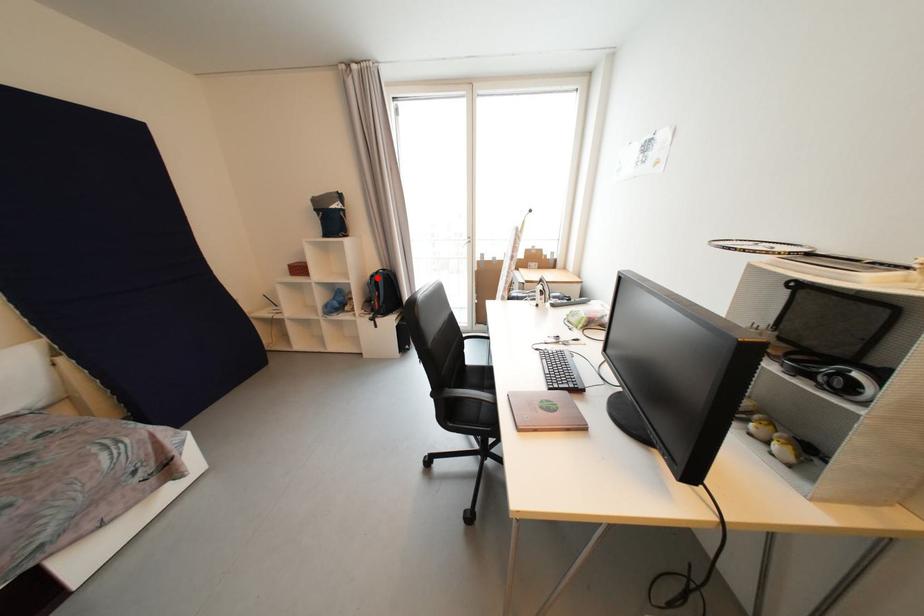
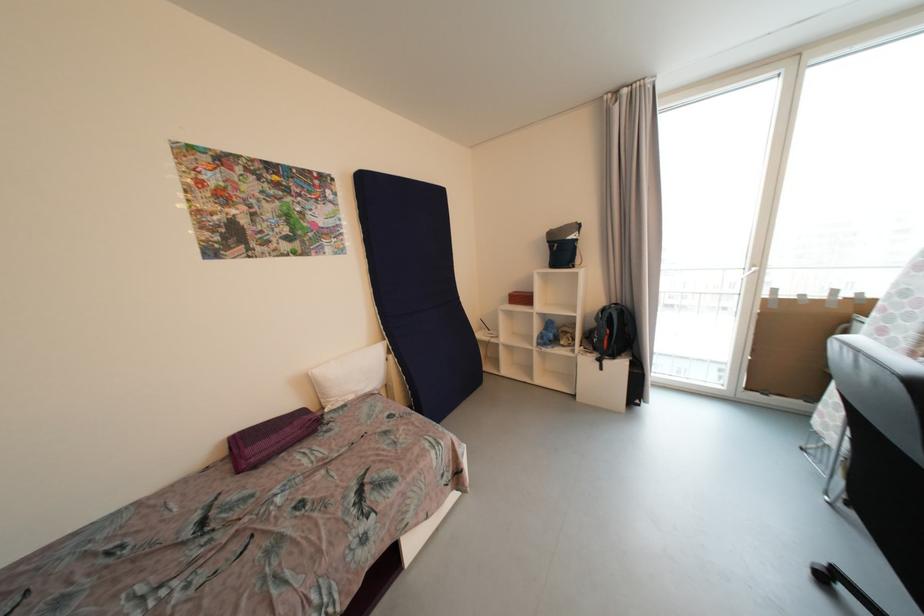
Question: I am providing you with two images of the same scene from different viewpoints. A red point is shown in image1. For the corresponding object point in image2, is it positioned nearer or farther from the camera?

Choices:
 (A) Nearer
 (B) Farther

Answer: (B)